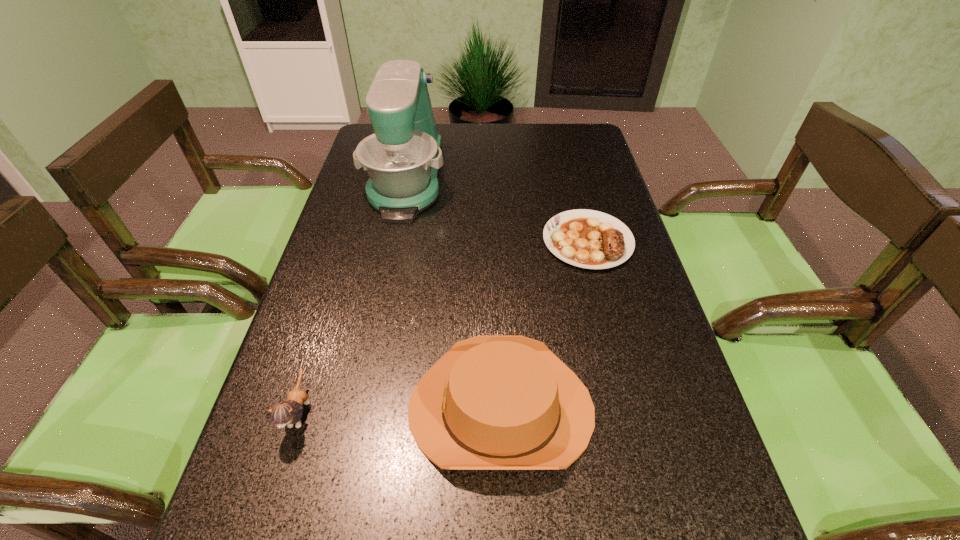
Where is `empty location between the cowboy hat and the tallest object`? empty location between the cowboy hat and the tallest object is located at coordinates (454, 293).

Identify the location of vacant point located between the shortest object and the tallest object. The height and width of the screenshot is (540, 960). (497, 210).

Where is `free space between the kitten and the steak`? The height and width of the screenshot is (540, 960). free space between the kitten and the steak is located at coordinates (444, 326).

Locate an element on the screen. This screenshot has height=540, width=960. vacant region between the kitten and the steak is located at coordinates (444, 326).

What are the coordinates of `free space between the mixer and the cowboy hat` in the screenshot? It's located at (454, 293).

The image size is (960, 540). Identify the location of free space between the mixer and the kitten. pos(353,295).

The width and height of the screenshot is (960, 540). In order to click on free point between the kitten and the tallest object in this screenshot , I will do `click(353, 295)`.

The image size is (960, 540). In order to click on vacant space in between the steak and the mixer in this screenshot , I will do `click(497, 210)`.

The height and width of the screenshot is (540, 960). I want to click on free space between the mixer and the cowboy hat, so click(x=454, y=293).

Locate an element on the screen. the closest object to the shortest object is located at coordinates point(493,402).